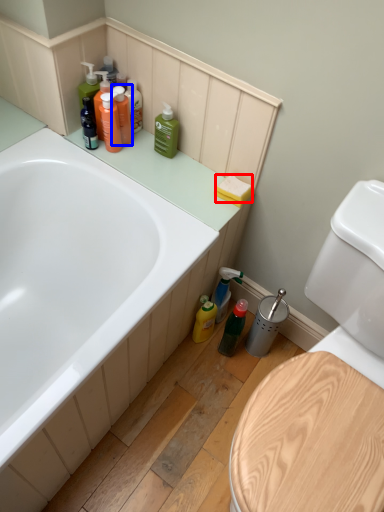
Question: Which object appears farthest to the camera in this image, toilet paper (highlighted by a red box) or cleaning product (highlighted by a blue box)?

Choices:
 (A) toilet paper
 (B) cleaning product

Answer: (B)